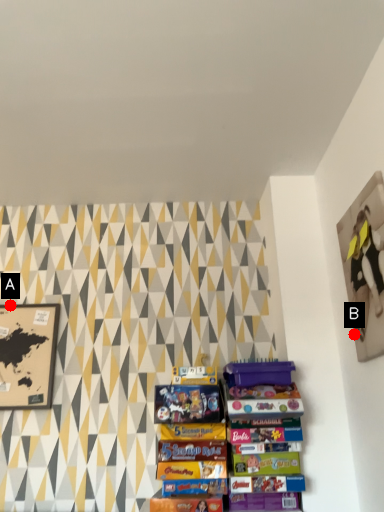
Question: Two points are circled on the image, labeled by A and B beside each circle. Which point appears closest to the camera in this image?

Choices:
 (A) A is closer
 (B) B is closer

Answer: (B)